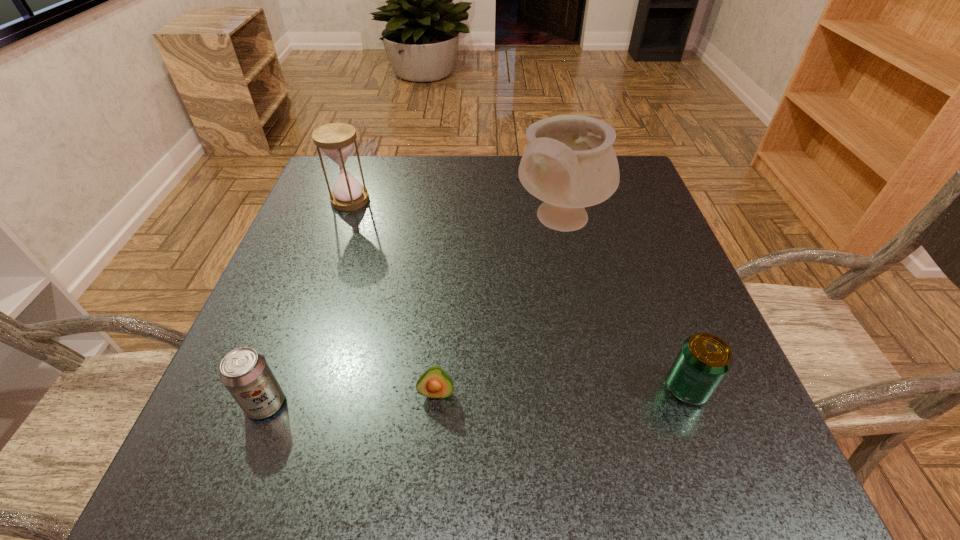
The width and height of the screenshot is (960, 540). I want to click on vacant point located between the third object from left to right and the fourth object from left to right, so click(499, 307).

Where is `vacant point located between the second tallest object and the tallest object`? This screenshot has width=960, height=540. vacant point located between the second tallest object and the tallest object is located at coordinates pyautogui.click(x=456, y=211).

You are a GUI agent. You are given a task and a screenshot of the screen. Output one action in this format:
    pyautogui.click(x=<x>, y=<y>)
    Task: Click on the vacant space that is in between the pottery and the rightmost object
    The height and width of the screenshot is (540, 960).
    Given the screenshot: What is the action you would take?
    point(624,305)

Locate an element on the screen. free area in between the tallest object and the left beer can is located at coordinates (414, 313).

At what (x,y) coordinates should I click in order to perform the action: click on free spot between the left beer can and the shortest object. Please return your answer as a coordinate pair (x, y). This screenshot has width=960, height=540. Looking at the image, I should click on (351, 398).

Where is `unoccupied area between the left beer can and the pottery`? The image size is (960, 540). unoccupied area between the left beer can and the pottery is located at coordinates (414, 313).

Find the location of a particular element. The width and height of the screenshot is (960, 540). unoccupied position between the left beer can and the third object from right to left is located at coordinates (351, 398).

Identify which object is the nearest to the fourth shortest object. Please provide its 2D coordinates. Your answer should be formatted as a tuple, i.e. [(x, y)], where the tuple contains the x and y coordinates of a point satisfying the conditions above.

[(569, 163)]

The width and height of the screenshot is (960, 540). What are the coordinates of `object that stands as the second closest to the fourth object from left to right` in the screenshot? It's located at (436, 383).

Find the location of a particular element. The width and height of the screenshot is (960, 540). vacant space that satisfies the following two spatial constraints: 1. on the front side of the hourglass; 2. on the left side of the right beer can is located at coordinates (283, 388).